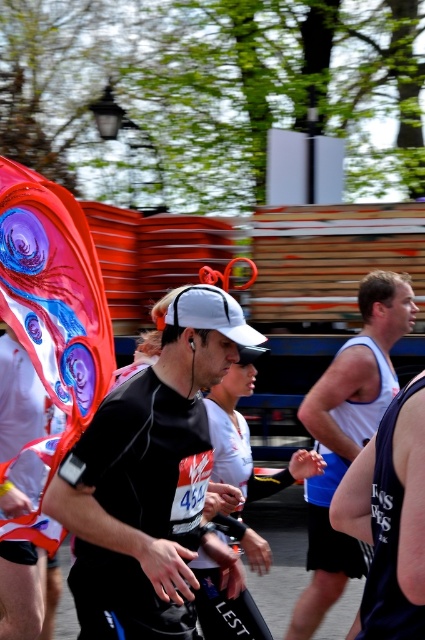
You are a photographer at the marathon event. You want to capture a photo of the black matte running shirt at center and the white matte cap at center. Which object should you focus on first if you want to ensure both are in the frame without moving the camera?

The black matte running shirt at center is taller than the white matte cap at center, so you should focus on the black matte running shirt at center first to ensure both are in frame since it occupies more vertical space.